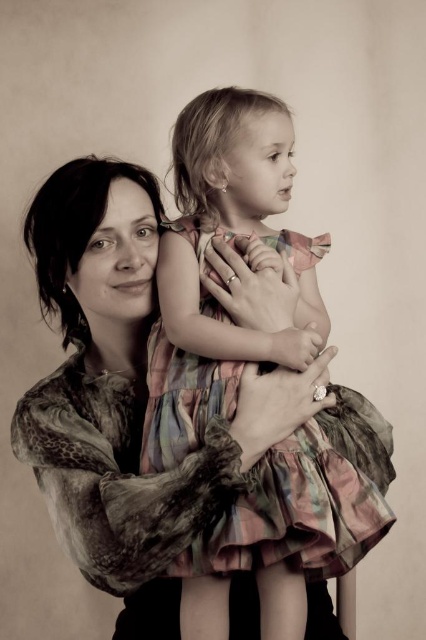
Who is more distant from viewer, (265, 144) or (226, 484)?

Point (265, 144)

The height and width of the screenshot is (640, 426). What do you see at coordinates (227, 269) in the screenshot?
I see `plaid fabric dress at center` at bounding box center [227, 269].

Locate an element on the screen. This screenshot has width=426, height=640. plaid fabric dress at center is located at coordinates (227, 269).